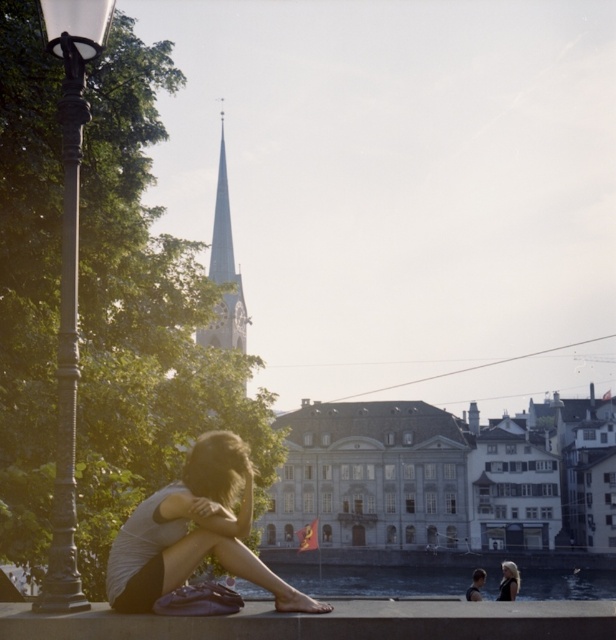
Who is lower down, matte gray shirt at center or dark blonde hair at lower right?

dark blonde hair at lower right is lower down.

Can you confirm if matte gray shirt at center is thinner than dark blonde hair at lower right?

In fact, matte gray shirt at center might be wider than dark blonde hair at lower right.

Does point (134, 573) come farther from viewer compared to point (505, 598)?

No, (134, 573) is in front of (505, 598).

Locate an element on the screen. The image size is (616, 640). matte gray shirt at center is located at coordinates (195, 532).

Does smooth concrete ledge at lower center have a greater width compared to dark blonde hair at lower right?

Correct, the width of smooth concrete ledge at lower center exceeds that of dark blonde hair at lower right.

Can you confirm if smooth concrete ledge at lower center is positioned to the right of dark blonde hair at lower right?

In fact, smooth concrete ledge at lower center is to the left of dark blonde hair at lower right.

Does point (14, 618) lie behind point (519, 589)?

No, it is not.

Locate an element on the screen. The image size is (616, 640). smooth concrete ledge at lower center is located at coordinates (331, 621).

Between smooth white spire at center and dark blonde hair at lower right, which one has more height?

With more height is smooth white spire at center.

Image resolution: width=616 pixels, height=640 pixels. Describe the element at coordinates (224, 269) in the screenshot. I see `smooth white spire at center` at that location.

Describe the element at coordinates (224, 269) in the screenshot. I see `smooth white spire at center` at that location.

This screenshot has height=640, width=616. Identify the location of smooth white spire at center. (x=224, y=269).